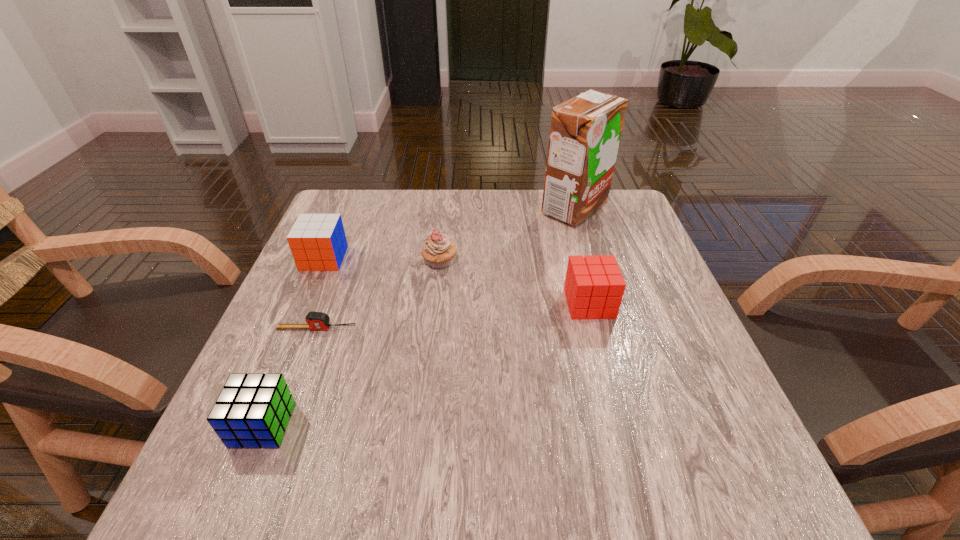
Where is `vacant space located 0.110m on the straw side of the carton`? The image size is (960, 540). vacant space located 0.110m on the straw side of the carton is located at coordinates (498, 209).

This screenshot has height=540, width=960. Identify the location of free space located 0.310m on the straw side of the carton. 424,209.

You are a GUI agent. You are given a task and a screenshot of the screen. Output one action in this format:
    pyautogui.click(x=<x>, y=<y>)
    Task: Click on the vacant position located on the right of the fourth object from left to right
    Image resolution: width=960 pixels, height=540 pixels.
    Given the screenshot: What is the action you would take?
    pyautogui.click(x=566, y=262)

This screenshot has height=540, width=960. What are the coordinates of `vacant area situated on the back of the farthest cube` in the screenshot? It's located at (346, 208).

Identify the location of vacant space located 0.320m on the front of the rightmost cube. (636, 480).

You are a GUI agent. You are given a task and a screenshot of the screen. Output one action in this format:
    pyautogui.click(x=<x>, y=<y>)
    Task: Click on the free region located 0.150m on the right of the nearest cube
    This screenshot has width=960, height=540.
    Given the screenshot: What is the action you would take?
    pyautogui.click(x=382, y=425)

The image size is (960, 540). In order to click on free location located 0.140m on the front of the tape measure in this screenshot , I will do `click(293, 394)`.

Image resolution: width=960 pixels, height=540 pixels. I want to click on object that is positioned at the far edge, so click(x=585, y=131).

Identify the location of object that is positioned at the near edge. This screenshot has height=540, width=960. (252, 411).

This screenshot has height=540, width=960. In order to click on tape measure present at the left edge in this screenshot , I will do `click(315, 320)`.